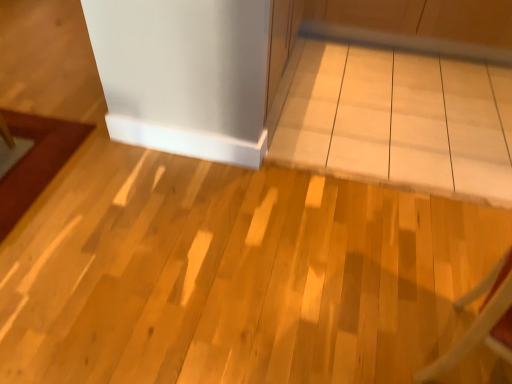
Locate an element on the screen. Image resolution: width=512 pixels, height=384 pixels. vacant region to the left of wooden chair at lower right is located at coordinates (357, 326).